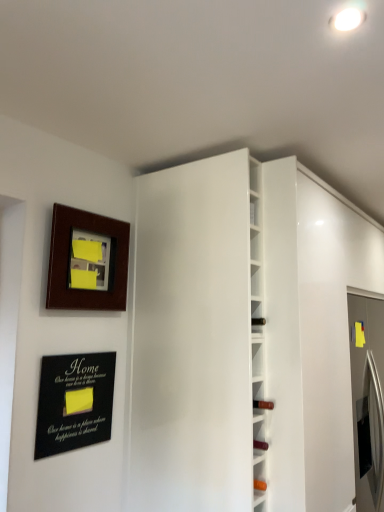
Find the location of a particular element. white glossy door at center is located at coordinates (192, 339).

Where is `wooden picture frame at upper left`? This screenshot has height=512, width=384. wooden picture frame at upper left is located at coordinates (87, 261).

Which object is thinner, black matte plaque at lower left or white glossy wine rack at center?

With smaller width is black matte plaque at lower left.

Identify the location of bookshelf lying in front of the black matte plaque at lower left. (244, 336).

Considering the sizes of black matte plaque at lower left and white glossy wine rack at center in the image, is black matte plaque at lower left taller or shorter than white glossy wine rack at center?

Clearly, black matte plaque at lower left is shorter compared to white glossy wine rack at center.

Is black matte plaque at lower left positioned behind white glossy wine rack at center?

That is True.

Is black matte plaque at lower left shorter than white glossy door at center?

Indeed, black matte plaque at lower left has a lesser height compared to white glossy door at center.

Who is smaller, black matte plaque at lower left or white glossy door at center?

black matte plaque at lower left.

From a real-world perspective, is black matte plaque at lower left physically below white glossy door at center?

Yes.

Is black matte plaque at lower left oriented away from white glossy door at center?

black matte plaque at lower left does not have its back to white glossy door at center.

Is white glossy door at center turned away from black matte plaque at lower left?

white glossy door at center does not have its back to black matte plaque at lower left.

Considering the points (167, 323) and (102, 434), which point is in front, point (167, 323) or point (102, 434)?

The point (102, 434) is more forward.

From a real-world perspective, which is physically above, white glossy door at center or black matte plaque at lower left?

In real-world perspective, white glossy door at center is above.

Who is shorter, white glossy door at center or black matte plaque at lower left?

Standing shorter between the two is black matte plaque at lower left.

Can you confirm if white glossy wine rack at center is wider than black matte plaque at lower left?

Yes, white glossy wine rack at center is wider than black matte plaque at lower left.

From a real-world perspective, does white glossy wine rack at center stand above black matte plaque at lower left?

Incorrect, from a real-world perspective, white glossy wine rack at center is lower than black matte plaque at lower left.

Would you say white glossy wine rack at center is inside or outside black matte plaque at lower left?

white glossy wine rack at center is outside black matte plaque at lower left.

Based on the photo, does white glossy wine rack at center appear on the right side of wooden picture frame at upper left?

Indeed, white glossy wine rack at center is positioned on the right side of wooden picture frame at upper left.

Which of these two, white glossy wine rack at center or wooden picture frame at upper left, is smaller?

wooden picture frame at upper left.

From the picture: Can you confirm if white glossy wine rack at center is wider than wooden picture frame at upper left?

Correct, the width of white glossy wine rack at center exceeds that of wooden picture frame at upper left.

From a real-world perspective, is white glossy door at center over white glossy wine rack at center?

Yes.

Based on the photo, is white glossy door at center positioned beyond the bounds of white glossy wine rack at center?

Yes.

Considering their positions, is white glossy door at center located in front of or behind white glossy wine rack at center?

Clearly, white glossy door at center is behind white glossy wine rack at center.

Locate an element on the screen. bookshelf in front of the white glossy door at center is located at coordinates (244, 336).

Which object is further away from the camera, white glossy door at center or wooden picture frame at upper left?

wooden picture frame at upper left is further away from the camera.

Is white glossy door at center inside the boundaries of wooden picture frame at upper left, or outside?

white glossy door at center is not inside wooden picture frame at upper left, it's outside.

Considering the relative sizes of white glossy door at center and wooden picture frame at upper left in the image provided, is white glossy door at center smaller than wooden picture frame at upper left?

No.

At what (x,y) coordinates should I click in order to perform the action: click on bookshelf below the black matte plaque at lower left (from a real-world perspective). Please return your answer as a coordinate pair (x, y). This screenshot has height=512, width=384. Looking at the image, I should click on (244, 336).

Locate an element on the screen. This screenshot has width=384, height=512. plaque behind the white glossy door at center is located at coordinates (74, 402).

Which object lies further to the anchor point white glossy wine rack at center, black matte plaque at lower left or wooden picture frame at upper left?

Based on the image, black matte plaque at lower left appears to be further to white glossy wine rack at center.

Looking at the image, which one is located further to white glossy door at center, wooden picture frame at upper left or white glossy wine rack at center?

Based on the image, wooden picture frame at upper left appears to be further to white glossy door at center.

Based on the photo, estimate the real-world distances between objects in this image. Which object is closer to black matte plaque at lower left, white glossy wine rack at center or wooden picture frame at upper left?

wooden picture frame at upper left is closer to black matte plaque at lower left.

From the image, which object appears to be farther from white glossy door at center, black matte plaque at lower left or white glossy wine rack at center?

black matte plaque at lower left.

In the scene shown: Which object lies further to the anchor point black matte plaque at lower left, wooden picture frame at upper left or white glossy door at center?

The object further to black matte plaque at lower left is white glossy door at center.

Based on their spatial positions, is wooden picture frame at upper left or white glossy door at center closer to white glossy wine rack at center?

white glossy door at center.

From the image, which object appears to be nearer to black matte plaque at lower left, white glossy wine rack at center or white glossy door at center?

white glossy door at center lies closer to black matte plaque at lower left than the other object.

Looking at the image, which one is located further to white glossy wine rack at center, wooden picture frame at upper left or black matte plaque at lower left?

black matte plaque at lower left is further to white glossy wine rack at center.

Where is `door between wooden picture frame at upper left and white glossy wine rack at center in the horizontal direction`? This screenshot has width=384, height=512. door between wooden picture frame at upper left and white glossy wine rack at center in the horizontal direction is located at coordinates (192, 339).

You are a GUI agent. You are given a task and a screenshot of the screen. Output one action in this format:
    pyautogui.click(x=<x>, y=<y>)
    Task: Click on the door between black matte plaque at lower left and white glossy wine rack at center from left to right
    This screenshot has height=512, width=384.
    Given the screenshot: What is the action you would take?
    pyautogui.click(x=192, y=339)

You are a GUI agent. You are given a task and a screenshot of the screen. Output one action in this format:
    pyautogui.click(x=<x>, y=<y>)
    Task: Click on the picture frame between black matte plaque at lower left and white glossy wine rack at center from left to right
    
    Given the screenshot: What is the action you would take?
    pyautogui.click(x=87, y=261)

Where is `door between wooden picture frame at upper left and black matte plaque at lower left in the up-down direction`? Image resolution: width=384 pixels, height=512 pixels. door between wooden picture frame at upper left and black matte plaque at lower left in the up-down direction is located at coordinates coord(192,339).